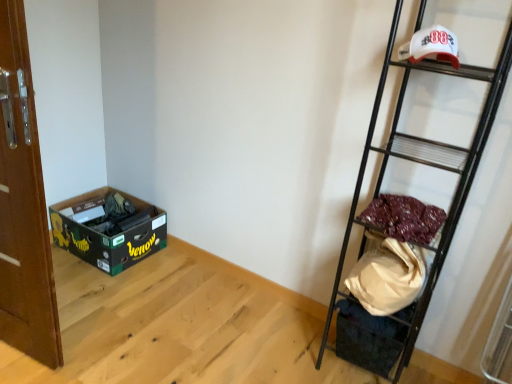
Question: Considering the relative sizes of black metal ladder at right and brown wooden door at left in the image provided, is black metal ladder at right taller than brown wooden door at left?

Choices:
 (A) yes
 (B) no

Answer: (A)

Question: Is black metal ladder at right shorter than brown wooden door at left?

Choices:
 (A) yes
 (B) no

Answer: (B)

Question: Is black metal ladder at right not inside brown wooden door at left?

Choices:
 (A) yes
 (B) no

Answer: (A)

Question: Can you confirm if black metal ladder at right is smaller than brown wooden door at left?

Choices:
 (A) no
 (B) yes

Answer: (A)

Question: From a real-world perspective, is black metal ladder at right under brown wooden door at left?

Choices:
 (A) yes
 (B) no

Answer: (B)

Question: Is black metal ladder at right facing towards brown wooden door at left?

Choices:
 (A) yes
 (B) no

Answer: (B)

Question: Is maroon fabric at right smaller than brown wooden door at left?

Choices:
 (A) yes
 (B) no

Answer: (A)

Question: Is maroon fabric at right thinner than brown wooden door at left?

Choices:
 (A) yes
 (B) no

Answer: (B)

Question: Are maroon fabric at right and brown wooden door at left beside each other?

Choices:
 (A) no
 (B) yes

Answer: (A)

Question: From a real-world perspective, does maroon fabric at right stand above brown wooden door at left?

Choices:
 (A) no
 (B) yes

Answer: (B)

Question: Can you confirm if maroon fabric at right is shorter than brown wooden door at left?

Choices:
 (A) yes
 (B) no

Answer: (A)

Question: Is maroon fabric at right oriented towards brown wooden door at left?

Choices:
 (A) yes
 (B) no

Answer: (B)

Question: Is brown wooden door at left far away from maroon fabric at right?

Choices:
 (A) no
 (B) yes

Answer: (B)